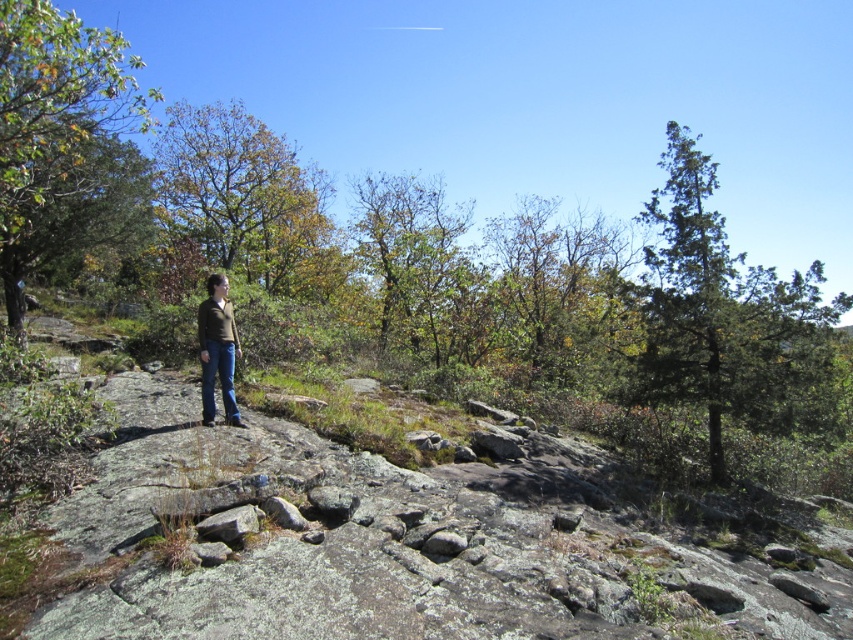
Question: Among these points, which one is nearest to the camera?

Choices:
 (A) (662, 234)
 (B) (189, 144)
 (C) (213, 310)

Answer: (C)

Question: Does green coniferous tree at upper right have a larger size compared to brown leafy tree at upper left?

Choices:
 (A) yes
 (B) no

Answer: (B)

Question: Is rocky terrain at center above yellow-green foliage at upper left?

Choices:
 (A) no
 (B) yes

Answer: (A)

Question: Based on their relative distances, which object is nearer to the brown leafy tree at upper left?

Choices:
 (A) brown matte jacket at center
 (B) green coniferous tree at upper right

Answer: (A)

Question: Which point is farther from the camera taking this photo?

Choices:
 (A) (811, 282)
 (B) (238, 228)
 (C) (228, 380)

Answer: (B)

Question: Is yellow-green foliage at upper left above brown matte jacket at center?

Choices:
 (A) yes
 (B) no

Answer: (A)